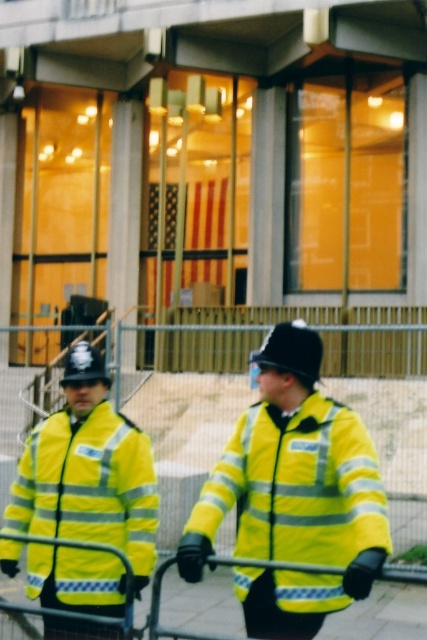
You are a delivery person trying to locate the security checkpoint. According to the image, where is the yellow reflective jacket at center located in terms of coordinates?

The yellow reflective jacket at center is located at coordinates point (298, 484).